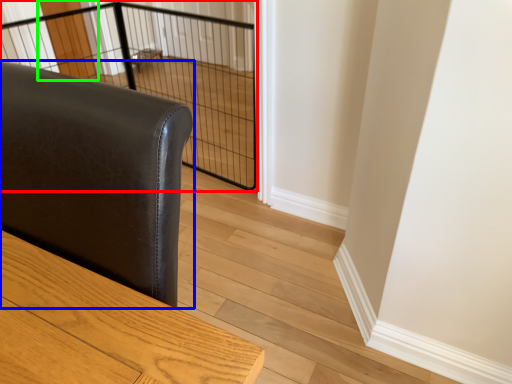
Question: Which is farther away from cage (highlighted by a red box)? furniture (highlighted by a blue box) or screen door (highlighted by a green box)?

Choices:
 (A) furniture
 (B) screen door

Answer: (A)